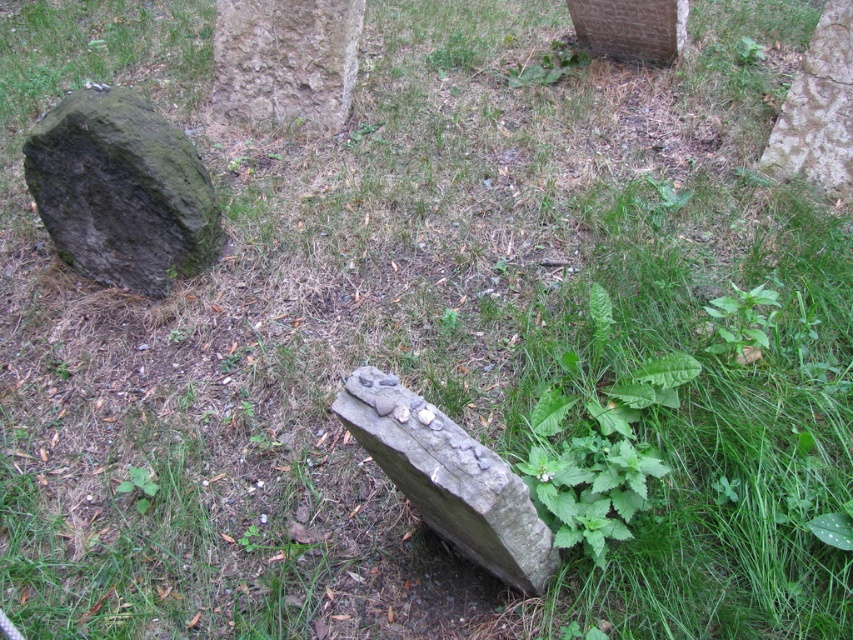
You are standing at the point marked as point (120,189) in the image. Looking around, you see a green mossy stone at left. Which direction should you face to see the green mossy stone at left?

Since you are standing at point (120,189) and the green mossy stone at left is located at that point, you are already facing the green mossy stone at left.

You are a gardener trying to clear the area between the green mossy stone at left and the smooth gray stone at upper center. Which stone has a larger width to consider when planning your gardening tools?

The green mossy stone at left has a larger width than the smooth gray stone at upper center, so you should consider its width when planning your gardening tools.